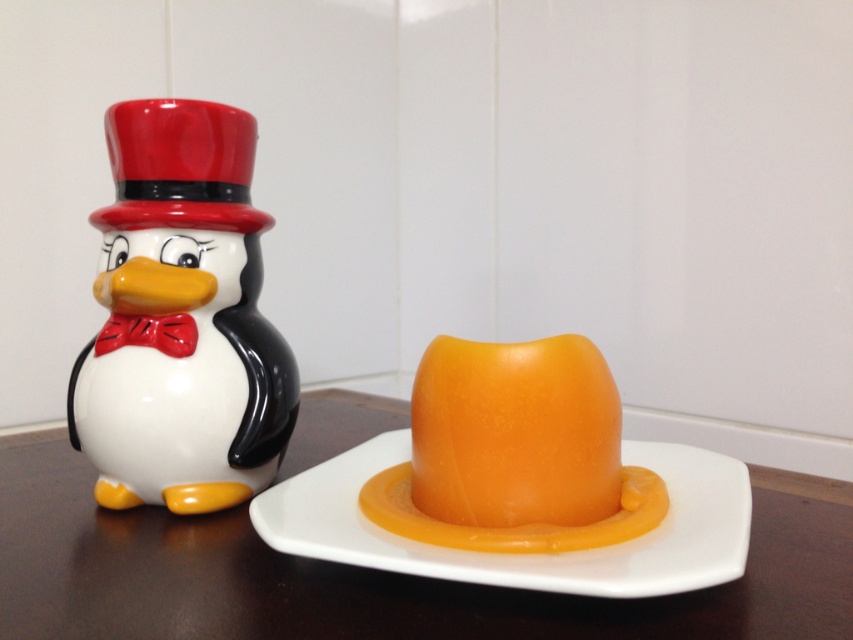
Is orange glossy hat at center to the left of matte white plate at center from the viewer's perspective?

Indeed, orange glossy hat at center is positioned on the left side of matte white plate at center.

Between orange glossy hat at center and matte white plate at center, which one has more height?

Standing taller between the two is orange glossy hat at center.

Who is more distant from viewer, (x=610, y=381) or (x=328, y=513)?

The point (x=610, y=381) is more distant.

Find the location of `orange glossy hat at center`. orange glossy hat at center is located at coordinates (514, 452).

Does point (338, 458) come farther from viewer compared to point (122, 145)?

Yes, point (338, 458) is farther from viewer.

Between matte white plate at center and glossy ceramic hat at upper left, which one appears on the left side from the viewer's perspective?

glossy ceramic hat at upper left

What do you see at coordinates (525, 554) in the screenshot?
I see `matte white plate at center` at bounding box center [525, 554].

Where is `matte white plate at center`? The image size is (853, 640). matte white plate at center is located at coordinates (525, 554).

Is glossy ceramic hat at upper left above matte red bow tie at left?

Yes, glossy ceramic hat at upper left is above matte red bow tie at left.

Where is `glossy ceramic hat at upper left`? glossy ceramic hat at upper left is located at coordinates (180, 166).

The image size is (853, 640). Identify the location of glossy ceramic hat at upper left. (180, 166).